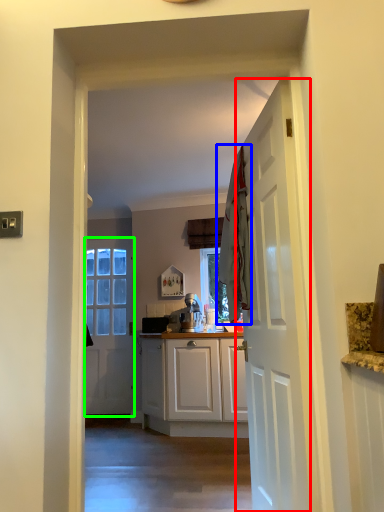
Question: Based on their relative distances, which object is nearer to door (highlighted by a red box)? Choose from laundry (highlighted by a blue box) and door (highlighted by a green box).

Choices:
 (A) laundry
 (B) door

Answer: (A)